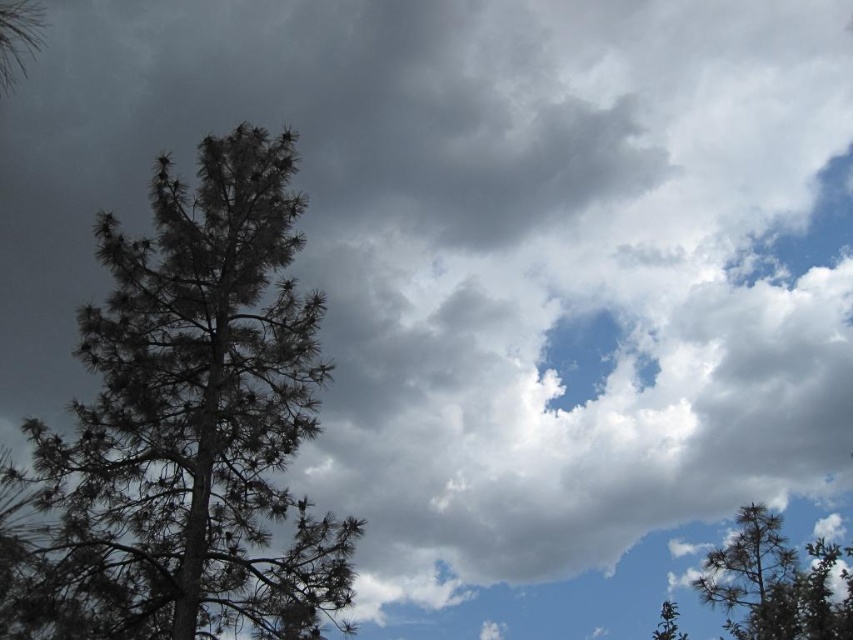
Question: Which point is farther to the camera?

Choices:
 (A) (775, 538)
 (B) (276, 486)

Answer: (B)

Question: Which of the following is the farthest from the observer?

Choices:
 (A) (213, 176)
 (B) (740, 573)

Answer: (A)

Question: Which of the following is the closest to the observer?

Choices:
 (A) (263, 156)
 (B) (828, 561)

Answer: (B)

Question: Is dark green needles at left behind green needle-like tree at lower right?

Choices:
 (A) yes
 (B) no

Answer: (A)

Question: Is dark green needles at left to the right of green needle-like tree at lower right from the viewer's perspective?

Choices:
 (A) no
 (B) yes

Answer: (A)

Question: Is dark green needles at left to the right of green needle-like tree at lower right from the viewer's perspective?

Choices:
 (A) yes
 (B) no

Answer: (B)